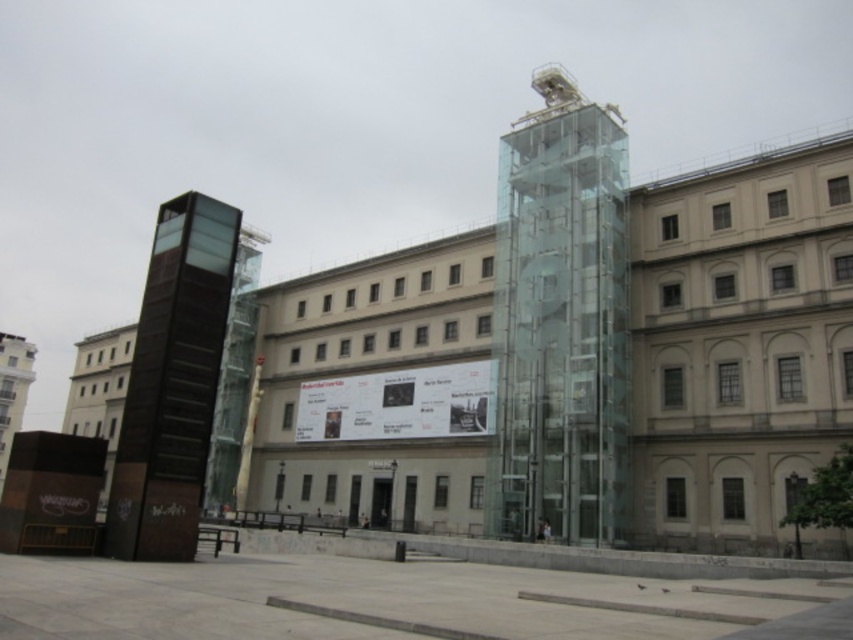
Does transparent glass tower at center have a smaller size compared to dark brown polished stone tower at left?

Actually, transparent glass tower at center might be larger than dark brown polished stone tower at left.

Does transparent glass tower at center appear under dark brown polished stone tower at left?

Incorrect, transparent glass tower at center is not positioned below dark brown polished stone tower at left.

At what (x,y) coordinates should I click in order to perform the action: click on transparent glass tower at center. Please return your answer as a coordinate pair (x, y). Looking at the image, I should click on (561, 321).